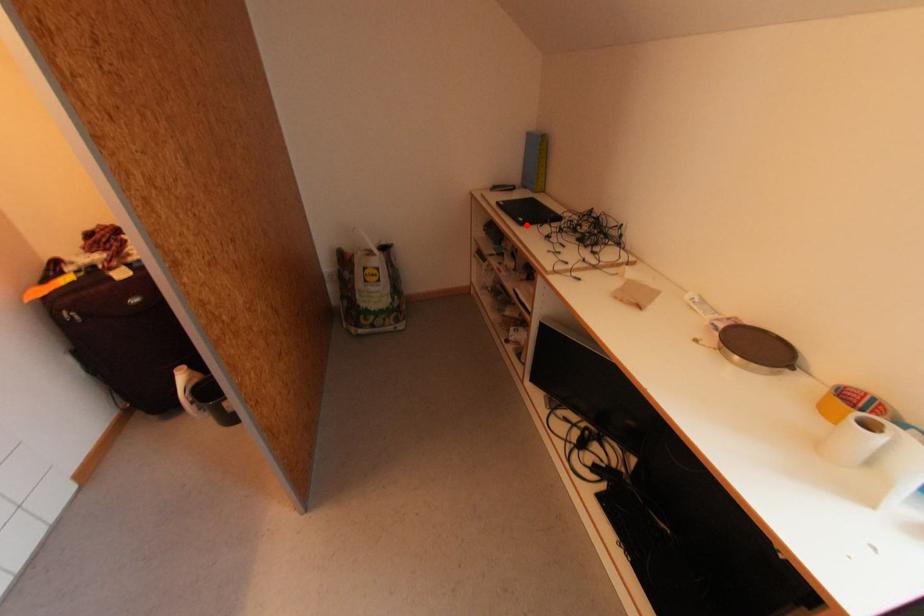
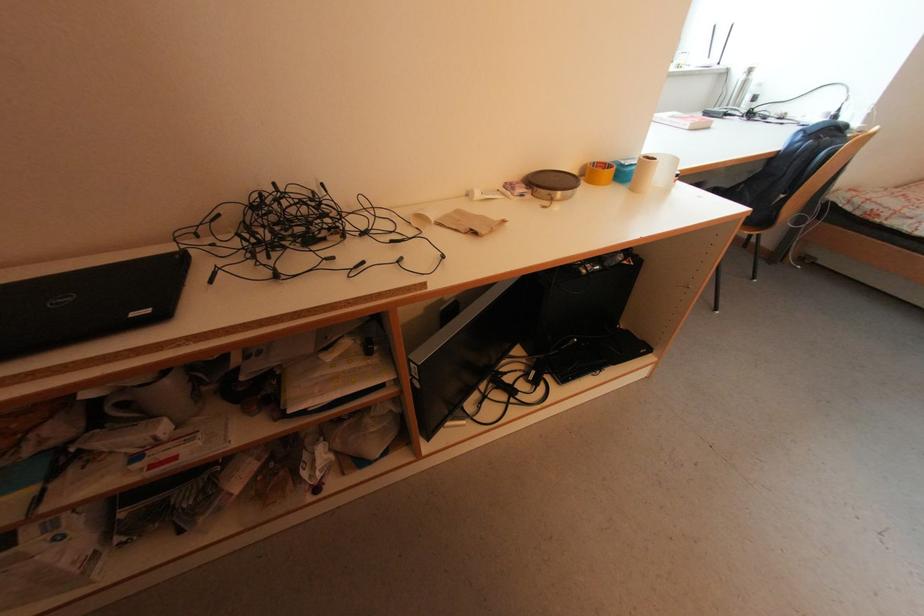
Locate, in the second image, the point that corresponds to the highlighted location in the first image.

(168, 317)